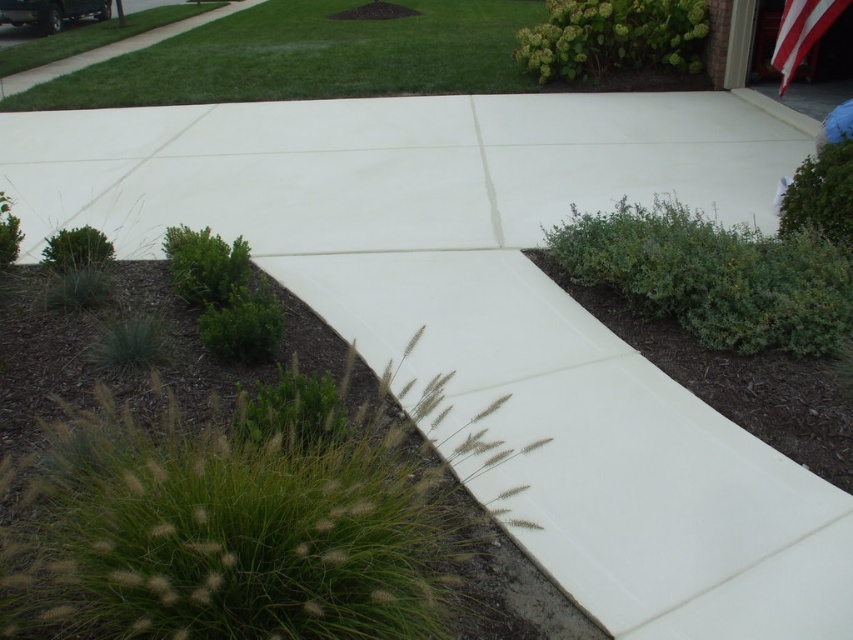
From the picture: Which is more to the left, green grass at upper center or striped fabric flag at upper right?

green grass at upper center is more to the left.

Does green grass at upper center appear under striped fabric flag at upper right?

No.

At what (x,y) coordinates should I click in order to perform the action: click on green grass at upper center. Please return your answer as a coordinate pair (x, y). This screenshot has height=640, width=853. Looking at the image, I should click on (310, 58).